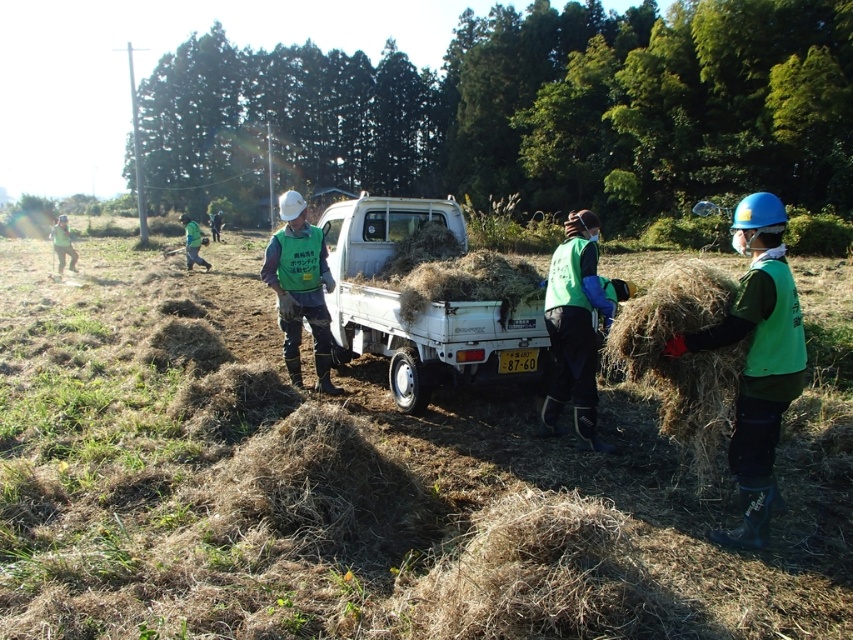
Question: Can you confirm if brown dry hay at right is positioned to the right of green fabric vest at left?

Choices:
 (A) no
 (B) yes

Answer: (B)

Question: Is brown dry hay at right wider than green fabric vest at left?

Choices:
 (A) yes
 (B) no

Answer: (B)

Question: Is brown dry hay at right positioned behind green fabric vest at left?

Choices:
 (A) no
 (B) yes

Answer: (A)